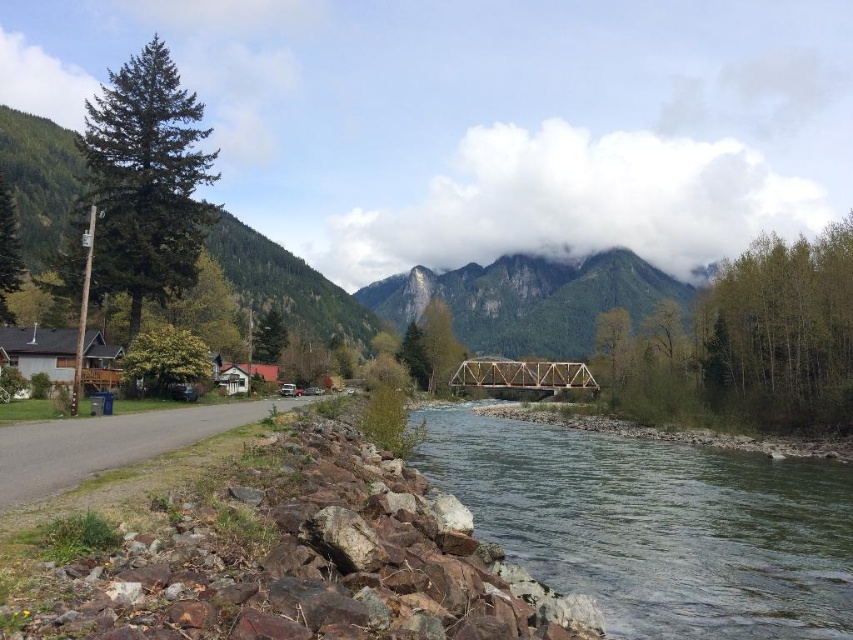
You are standing at the origin point of the image. You want to reach the clear water at center. Which direction should you move in terms of x and y coordinates?

The clear water at center is located at coordinates point (654,525), so you should move in the positive x and positive y direction to reach it.